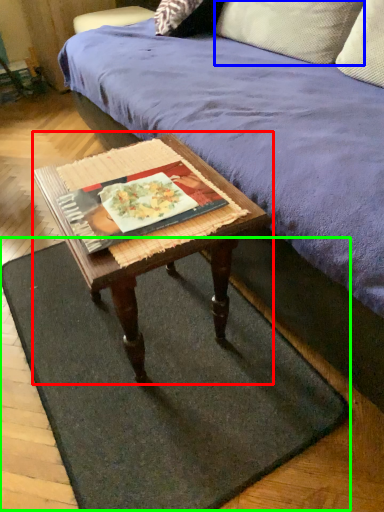
Question: Estimate the real-world distances between objects in this image. Which object is closer to coffee table (highlighted by a red box), pillow (highlighted by a blue box) or doormat (highlighted by a green box)?

Choices:
 (A) pillow
 (B) doormat

Answer: (B)